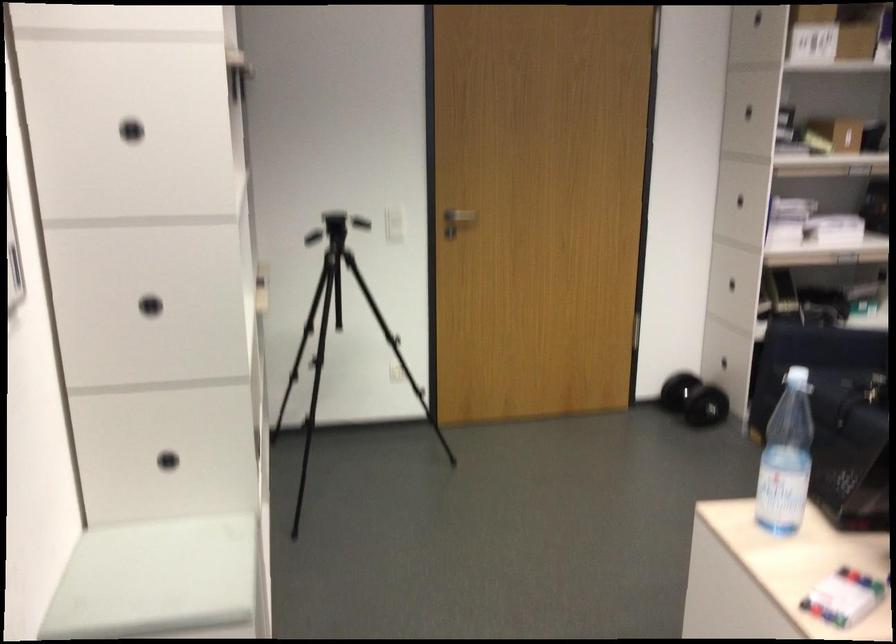
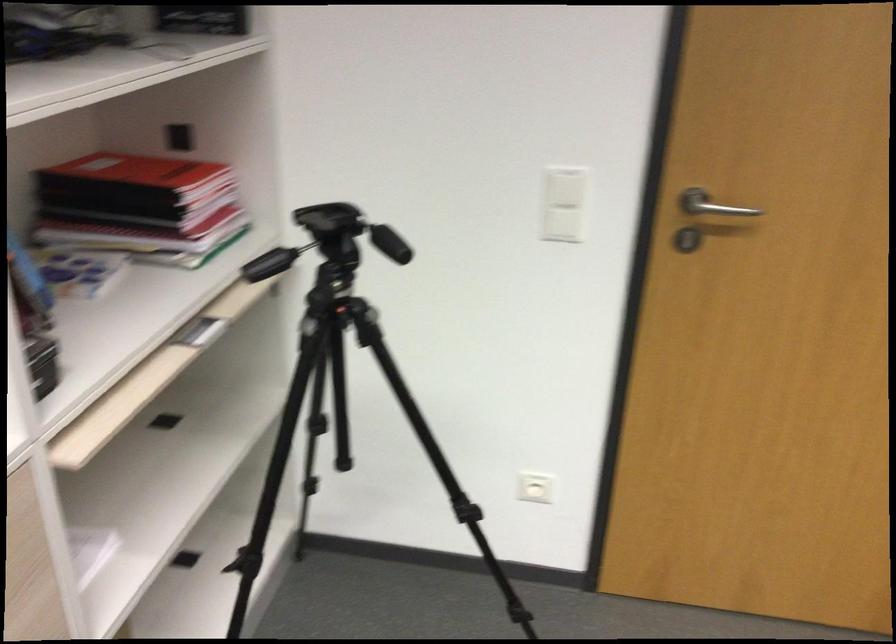
In the second image, find the point that corresponds to (x=435, y=214) in the first image.

(711, 205)